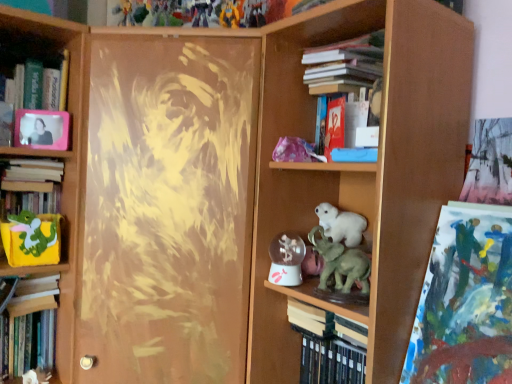
Question: Could you tell me if red matte book at upper center, the 2th paperback book when ordered from bottom to top, is facing abstract acrylic painting at upper right?

Choices:
 (A) yes
 (B) no

Answer: (B)

Question: Does red matte book at upper center, which is the first paperback book from top to bottom, touch abstract acrylic painting at upper right?

Choices:
 (A) no
 (B) yes

Answer: (A)

Question: Considering the relative positions of red matte book at upper center, the 2th paperback book when ordered from bottom to top, and abstract acrylic painting at upper right in the image provided, is red matte book at upper center, the 2th paperback book when ordered from bottom to top, to the right of abstract acrylic painting at upper right from the viewer's perspective?

Choices:
 (A) yes
 (B) no

Answer: (B)

Question: Can you confirm if red matte book at upper center, the 2th paperback book when ordered from bottom to top, is bigger than abstract acrylic painting at upper right?

Choices:
 (A) no
 (B) yes

Answer: (A)

Question: Does red matte book at upper center, the second paperback book when ordered from back to front, lie in front of abstract acrylic painting at upper right?

Choices:
 (A) yes
 (B) no

Answer: (B)

Question: Is red matte book at upper center, the second paperback book when ordered from back to front, completely or partially outside of abstract acrylic painting at upper right?

Choices:
 (A) no
 (B) yes

Answer: (B)

Question: From the image's perspective, is pink plastic picture frame at upper left beneath hardcover book at left, which is the third book from bottom to top?

Choices:
 (A) yes
 (B) no

Answer: (B)

Question: Is pink plastic picture frame at upper left bigger than hardcover book at left, which is the third book from bottom to top?

Choices:
 (A) yes
 (B) no

Answer: (B)

Question: Is hardcover book at left, which is the third book from bottom to top, located within pink plastic picture frame at upper left?

Choices:
 (A) yes
 (B) no

Answer: (B)

Question: Is pink plastic picture frame at upper left closer to the viewer compared to hardcover book at left, which is the 2th book in left-to-right order?

Choices:
 (A) no
 (B) yes

Answer: (A)

Question: Is pink plastic picture frame at upper left taller than hardcover book at left, positioned as the fourth book in right-to-left order?

Choices:
 (A) yes
 (B) no

Answer: (A)

Question: Can you confirm if pink plastic picture frame at upper left is positioned to the right of hardcover book at left, positioned as the fourth book in right-to-left order?

Choices:
 (A) no
 (B) yes

Answer: (B)

Question: Considering the relative positions of hardcover book at left, the third book from the top, and matte green plush toy at left, positioned as the 1th animal in left-to-right order, in the image provided, is hardcover book at left, the third book from the top, to the right of matte green plush toy at left, positioned as the 1th animal in left-to-right order, from the viewer's perspective?

Choices:
 (A) no
 (B) yes

Answer: (A)